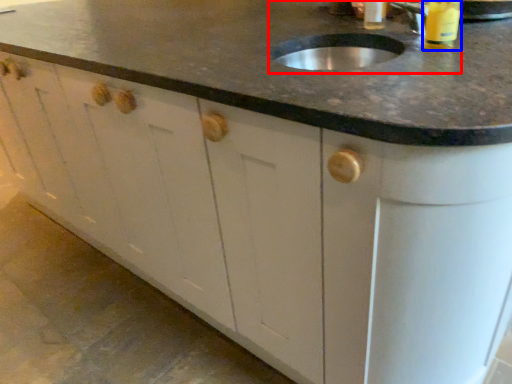
Question: Among these objects, which one is farthest to the camera, sink (highlighted by a red box) or beverage (highlighted by a blue box)?

Choices:
 (A) sink
 (B) beverage

Answer: (B)